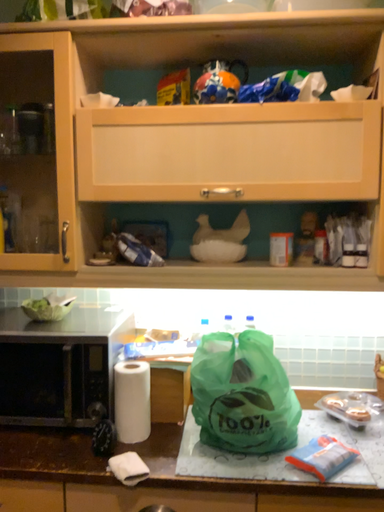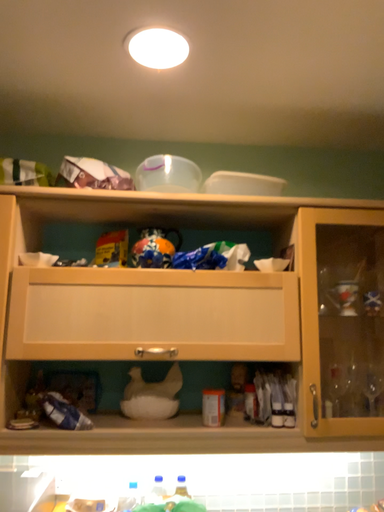
Question: How did the camera likely rotate when shooting the video?

Choices:
 (A) rotated left
 (B) rotated right

Answer: (B)